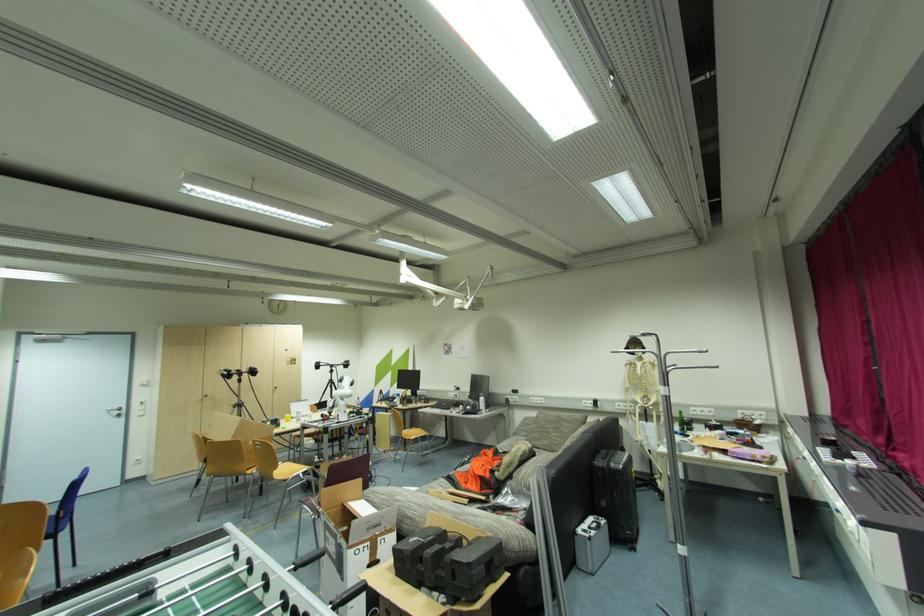
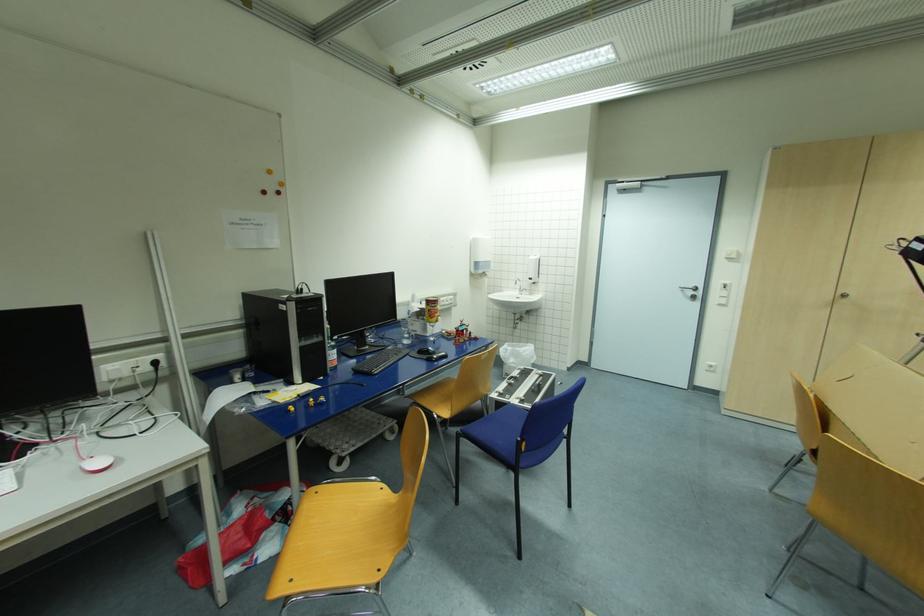
Where in the second image is the point corresponding to the point at 210,397 from the first image?

(847, 296)